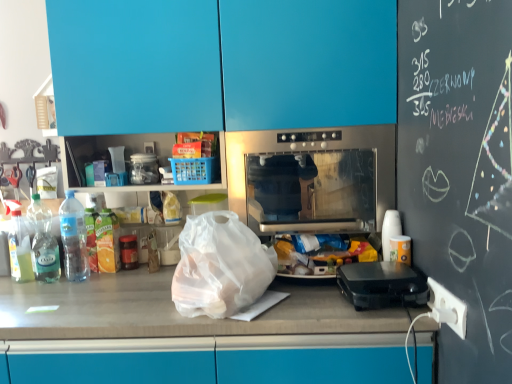
Question: From a real-world perspective, is blue glossy cabinets at upper center physically above black plastic waffle maker at right?

Choices:
 (A) yes
 (B) no

Answer: (A)

Question: From a real-world perspective, is blue glossy cabinets at upper center located beneath black plastic waffle maker at right?

Choices:
 (A) no
 (B) yes

Answer: (A)

Question: Is blue glossy cabinets at upper center facing towards black plastic waffle maker at right?

Choices:
 (A) yes
 (B) no

Answer: (A)

Question: Does blue glossy cabinets at upper center have a larger size compared to black plastic waffle maker at right?

Choices:
 (A) yes
 (B) no

Answer: (A)

Question: From the image's perspective, would you say blue glossy cabinets at upper center is positioned over black plastic waffle maker at right?

Choices:
 (A) no
 (B) yes

Answer: (B)

Question: Do you think translucent plastic bottle at left, marked as the third bottle in a left-to-right arrangement, is within blue glossy cabinets at upper center, or outside of it?

Choices:
 (A) inside
 (B) outside

Answer: (A)

Question: Does point (70, 274) appear closer or farther from the camera than point (90, 21)?

Choices:
 (A) closer
 (B) farther

Answer: (B)

Question: Looking at their shapes, would you say translucent plastic bottle at left, which ranks as the first bottle in right-to-left order, is wider or thinner than blue glossy cabinets at upper center?

Choices:
 (A) wide
 (B) thin

Answer: (B)

Question: Visually, is translucent plastic bottle at left, which ranks as the first bottle in right-to-left order, positioned to the left or to the right of blue glossy cabinets at upper center?

Choices:
 (A) right
 (B) left

Answer: (B)

Question: Is point (279, 1) positioned closer to the camera than point (349, 142)?

Choices:
 (A) closer
 (B) farther

Answer: (A)

Question: Considering the positions of blue glossy cabinets at upper center and stainless steel oven at center in the image, is blue glossy cabinets at upper center taller or shorter than stainless steel oven at center?

Choices:
 (A) tall
 (B) short

Answer: (A)

Question: Considering the positions of blue glossy cabinets at upper center and stainless steel oven at center in the image, is blue glossy cabinets at upper center bigger or smaller than stainless steel oven at center?

Choices:
 (A) big
 (B) small

Answer: (A)

Question: From the image's perspective, is blue glossy cabinets at upper center positioned above or below stainless steel oven at center?

Choices:
 (A) below
 (B) above

Answer: (B)

Question: Which is correct: stainless steel oven at center is inside clear plastic bottle at left, the first bottle in the left-to-right sequence, or outside of it?

Choices:
 (A) inside
 (B) outside

Answer: (B)

Question: Is stainless steel oven at center taller or shorter than clear plastic bottle at left, the first bottle in the left-to-right sequence?

Choices:
 (A) short
 (B) tall

Answer: (B)